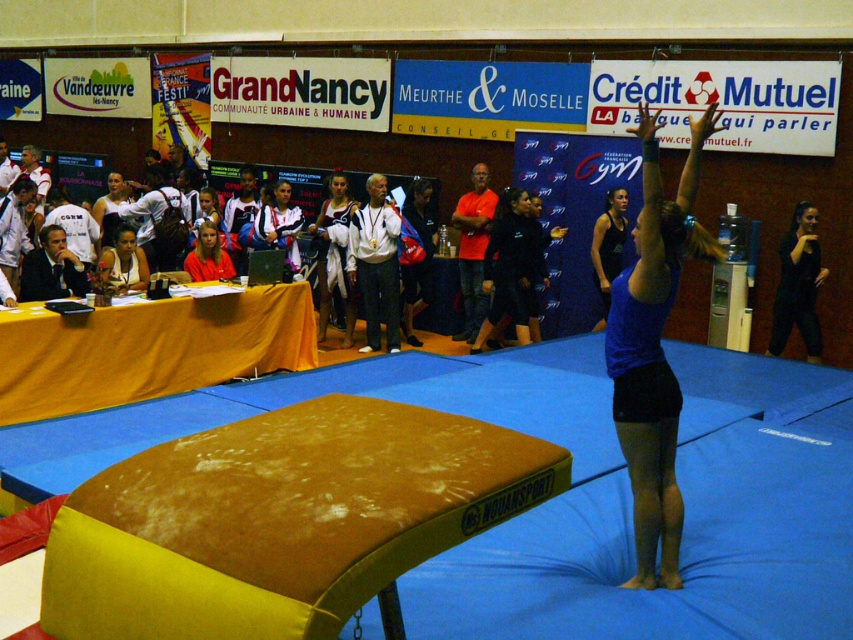
Does white cotton shirt at center have a lesser height compared to matte black jacket at center?

No, white cotton shirt at center is not shorter than matte black jacket at center.

Between white cotton shirt at center and matte black jacket at center, which one has less height?

Standing shorter between the two is matte black jacket at center.

The width and height of the screenshot is (853, 640). Find the location of `white cotton shirt at center`. white cotton shirt at center is located at coordinates (334, 257).

The height and width of the screenshot is (640, 853). Find the location of `white cotton shirt at center`. white cotton shirt at center is located at coordinates (334, 257).

Does white cotton shirt at center have a lesser height compared to red fabric shirt at center?

In fact, white cotton shirt at center may be taller than red fabric shirt at center.

Does white cotton shirt at center lie in front of red fabric shirt at center?

No, it is not.

This screenshot has height=640, width=853. Describe the element at coordinates (334, 257) in the screenshot. I see `white cotton shirt at center` at that location.

At what (x,y) coordinates should I click in order to perform the action: click on white cotton shirt at center. Please return your answer as a coordinate pair (x, y). Looking at the image, I should click on (334, 257).

This screenshot has height=640, width=853. Identify the location of blue matte tank top at center. (654, 352).